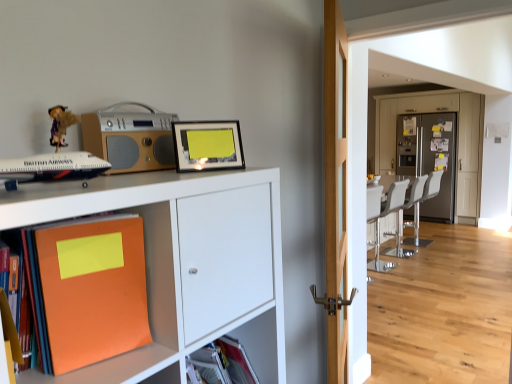
Question: From the image's perspective, does matte black picture frame at upper center appear lower than white leather chair at right?

Choices:
 (A) yes
 (B) no

Answer: (B)

Question: Can you confirm if matte black picture frame at upper center is bigger than white leather chair at right?

Choices:
 (A) yes
 (B) no

Answer: (B)

Question: From the image's perspective, is matte black picture frame at upper center on top of white leather chair at right?

Choices:
 (A) yes
 (B) no

Answer: (A)

Question: Is matte black picture frame at upper center positioned beyond the bounds of white leather chair at right?

Choices:
 (A) no
 (B) yes

Answer: (B)

Question: Considering the relative sizes of matte black picture frame at upper center and white leather chair at right in the image provided, is matte black picture frame at upper center wider than white leather chair at right?

Choices:
 (A) no
 (B) yes

Answer: (A)

Question: Is matte black picture frame at upper center taller than white leather chair at right?

Choices:
 (A) no
 (B) yes

Answer: (A)

Question: Can you confirm if matte black airplane at left is shorter than orange matte book at lower left, the first book viewed from the left?

Choices:
 (A) yes
 (B) no

Answer: (A)

Question: Can you confirm if matte black airplane at left is thinner than orange matte book at lower left, which is the second book in right-to-left order?

Choices:
 (A) yes
 (B) no

Answer: (B)

Question: Does matte black airplane at left have a smaller size compared to orange matte book at lower left, the first book viewed from the left?

Choices:
 (A) yes
 (B) no

Answer: (B)

Question: From the image's perspective, is matte black airplane at left beneath orange matte book at lower left, which is the second book in right-to-left order?

Choices:
 (A) no
 (B) yes

Answer: (A)

Question: From a real-world perspective, is matte black airplane at left positioned over orange matte book at lower left, which is the second book in right-to-left order, based on gravity?

Choices:
 (A) yes
 (B) no

Answer: (A)

Question: Considering the relative sizes of matte black airplane at left and orange matte book at lower left, the first book viewed from the left, in the image provided, is matte black airplane at left wider than orange matte book at lower left, the first book viewed from the left,?

Choices:
 (A) yes
 (B) no

Answer: (A)

Question: Considering the relative positions of metallic gray refrigerator at center and matte black picture frame at upper center in the image provided, is metallic gray refrigerator at center to the left of matte black picture frame at upper center from the viewer's perspective?

Choices:
 (A) yes
 (B) no

Answer: (B)